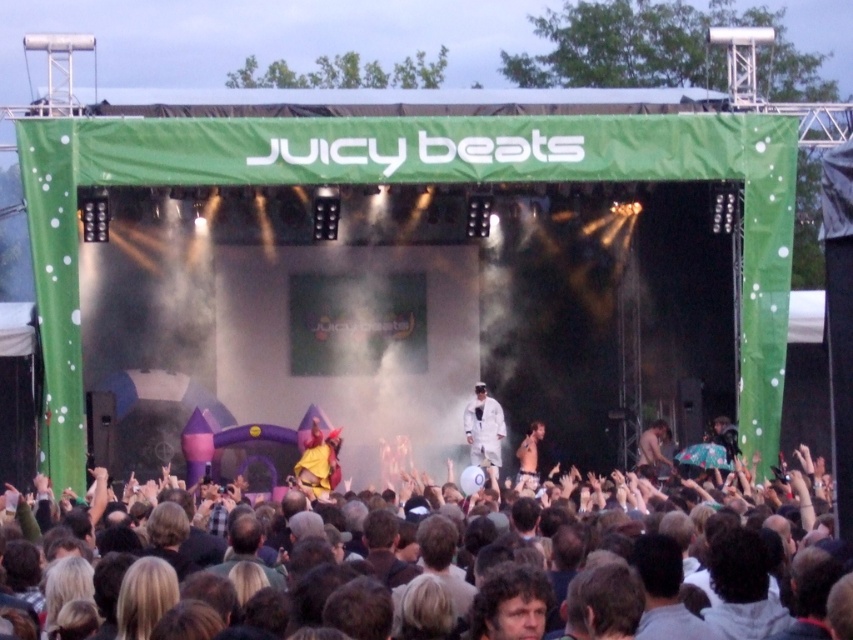
Question: Does dark brown leather jacket at lower right have a lesser width compared to white cotton shirt at center?

Choices:
 (A) yes
 (B) no

Answer: (A)

Question: Based on their relative distances, which object is farther from the white cotton shirt at center?

Choices:
 (A) white matte suit at center
 (B) yellow fabric at center

Answer: (B)

Question: Which object is farther from the camera taking this photo?

Choices:
 (A) white cotton shirt at center
 (B) white matte suit at center

Answer: (A)

Question: Can you confirm if yellow fabric at center is smaller than white cotton shirt at center?

Choices:
 (A) no
 (B) yes

Answer: (B)

Question: Is dark brown leather jacket at lower right to the right of white cotton shirt at center from the viewer's perspective?

Choices:
 (A) yes
 (B) no

Answer: (A)

Question: Among these points, which one is nearest to the camera?

Choices:
 (A) (659, 461)
 (B) (444, 563)

Answer: (B)